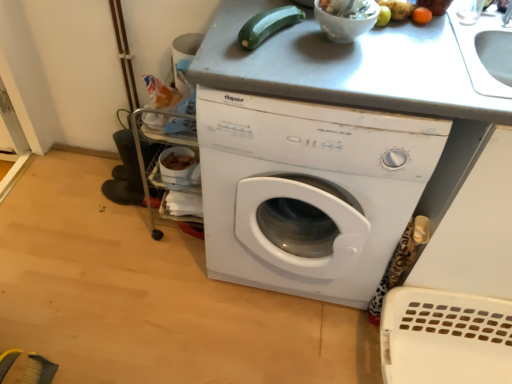
Find the location of a particular element. The height and width of the screenshot is (384, 512). free space between white glossy bowl at upper center and orange matte fruit at upper right, the second vegetable from the left is located at coordinates (396, 36).